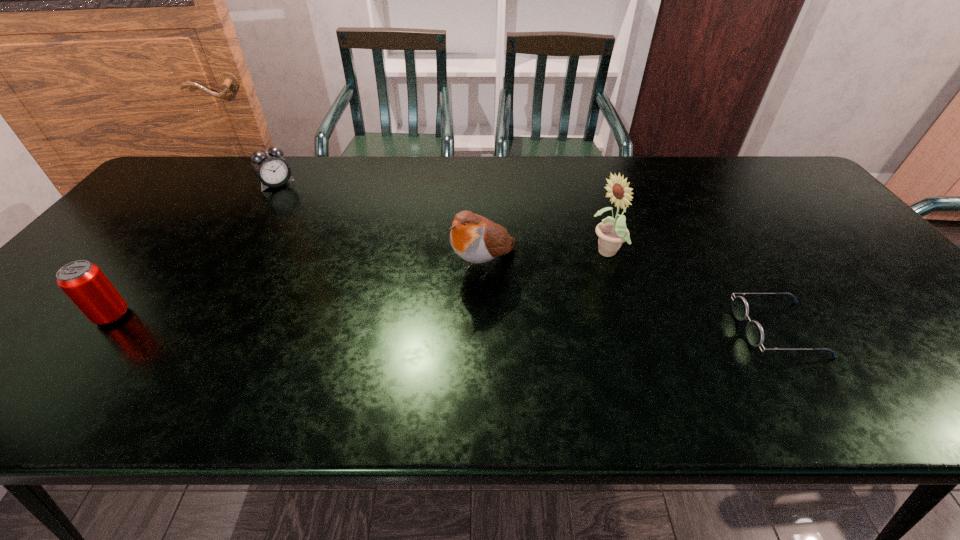
Identify the location of free space between the fourth object from left to right and the rightmost object. This screenshot has width=960, height=540. (692, 292).

Identify which object is located as the nearest to the farthest object. Please provide its 2D coordinates. Your answer should be formatted as a tuple, i.e. [(x, y)], where the tuple contains the x and y coordinates of a point satisfying the conditions above.

[(84, 283)]

The image size is (960, 540). What are the coordinates of `object that can be found as the third closest to the can` in the screenshot? It's located at (612, 232).

Where is `blank space that satisfies the following two spatial constraints: 1. on the back side of the can; 2. on the left side of the second shortest object`? blank space that satisfies the following two spatial constraints: 1. on the back side of the can; 2. on the left side of the second shortest object is located at coordinates (217, 184).

Image resolution: width=960 pixels, height=540 pixels. Find the location of `vacant space that satisfies the following two spatial constraints: 1. on the front side of the rightmost object; 2. on the front-facing side of the alarm clock`. vacant space that satisfies the following two spatial constraints: 1. on the front side of the rightmost object; 2. on the front-facing side of the alarm clock is located at coordinates (188, 330).

At what (x,y) coordinates should I click in order to perform the action: click on vacant position in the image that satisfies the following two spatial constraints: 1. on the back side of the can; 2. on the left side of the sunflower. Please return your answer as a coordinate pair (x, y). This screenshot has width=960, height=540. Looking at the image, I should click on (161, 253).

Find the location of a particular element. The width and height of the screenshot is (960, 540). vacant space that satisfies the following two spatial constraints: 1. on the front side of the farthest object; 2. on the front-facing side of the sunglasses is located at coordinates (188, 330).